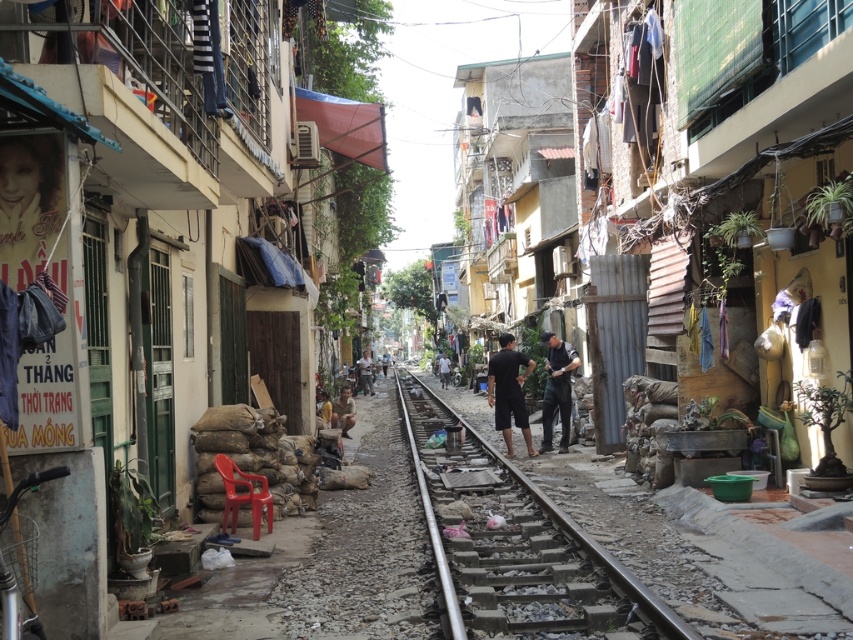
You are a delivery person standing at the edge of the street. You need to deliver a package to the building with the sandbags. You see the black matte shorts at center and dark blue fabric at center. Which object is bigger?

The black matte shorts at center is larger in size than the dark blue fabric at center, so the black matte shorts at center is bigger.

You are a delivery person trying to navigate through the narrow street. You need to pass between the metal railway line at center and the dark gray fabric at center. Can your delivery cart, which is 1.2 meters wide, fit through the space between them?

The metal railway line at center is wider than the dark gray fabric at center. However, the question is about the space between them. Since the exact distance isn not provided, but the railway line is wider, it might reduce the available space. Without specific measurements, it is uncertain if the 1.2 meter cart can fit. Please check the actual gap physically.